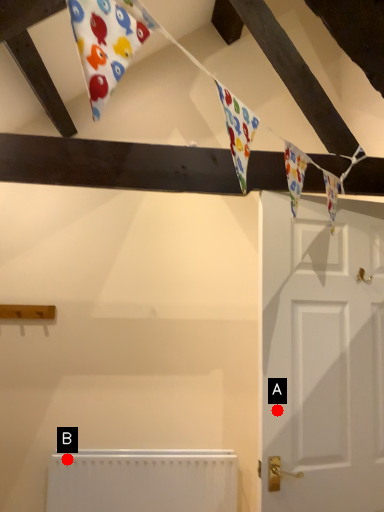
Question: Two points are circled on the image, labeled by A and B beside each circle. Which point is farther from the camera taking this photo?

Choices:
 (A) A is further
 (B) B is further

Answer: (B)